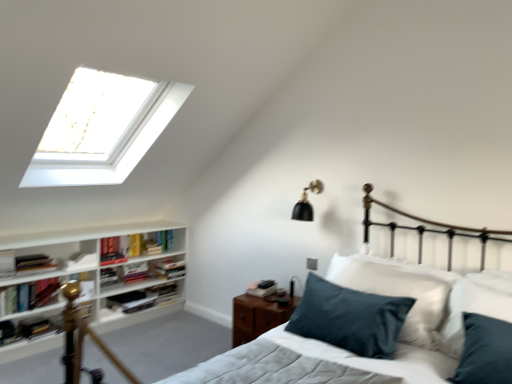
The width and height of the screenshot is (512, 384). Find the location of `hardcover book at center, placed as the 3th book when sorted from bottom to top`. hardcover book at center, placed as the 3th book when sorted from bottom to top is located at coordinates click(163, 291).

Describe the element at coordinates (163, 291) in the screenshot. I see `hardcover book at center, the 7th book viewed from the top` at that location.

The height and width of the screenshot is (384, 512). In order to click on white wooden bookshelf at left in this screenshot , I will do tap(96, 272).

Describe the element at coordinates (143, 298) in the screenshot. This screenshot has width=512, height=384. I see `hardcover book at center, which appears as the second book when ordered from the bottom` at that location.

What is the approximate width of black matte wall sconce at upper right?

24.34 centimeters.

The width and height of the screenshot is (512, 384). What do you see at coordinates (169, 268) in the screenshot? I see `hardcover book at center-left, the fourth book when ordered from top to bottom` at bounding box center [169, 268].

This screenshot has width=512, height=384. I want to click on white paper at left, which is the seventh book in bottom-to-top order, so click(x=81, y=262).

From the image's perspective, which is above, teal satin pillow at center or hardcover book at center, placed as the 3th book when sorted from bottom to top?

From the image's view, teal satin pillow at center is above.

Consider the image. How far apart are teal satin pillow at center and hardcover book at center, the 7th book viewed from the top?

2.85 meters.

In the scene shown: Is teal satin pillow at center positioned in front of hardcover book at center, placed as the 3th book when sorted from bottom to top?

Yes, it is in front of hardcover book at center, placed as the 3th book when sorted from bottom to top.

Does teal satin pillow at center have a greater width compared to hardcover book at center, placed as the 3th book when sorted from bottom to top?

Correct, the width of teal satin pillow at center exceeds that of hardcover book at center, placed as the 3th book when sorted from bottom to top.

Is hardcover book at left, which appears as the sixth book when viewed from the top, oriented towards hardcover book at center-left, which is counted as the sixth book, starting from the bottom?

No, hardcover book at left, which appears as the sixth book when viewed from the top, is not oriented towards hardcover book at center-left, which is counted as the sixth book, starting from the bottom.

Does hardcover book at left, which appears as the sixth book when viewed from the top, contain hardcover book at center-left, which is counted as the sixth book, starting from the bottom?

No, hardcover book at center-left, which is counted as the sixth book, starting from the bottom, is not a part of hardcover book at left, which appears as the sixth book when viewed from the top.

Which is behind, point (50, 295) or point (157, 263)?

The point (157, 263) is more distant.

Considering the positions of objects hardcover book at left, which appears as the sixth book when viewed from the top, and hardcover book at center-left, which is counted as the sixth book, starting from the bottom, in the image provided, who is in front, hardcover book at left, which appears as the sixth book when viewed from the top, or hardcover book at center-left, which is counted as the sixth book, starting from the bottom,?

Positioned in front is hardcover book at left, which appears as the sixth book when viewed from the top.

Is hardcover book at left, placed as the ninth book when sorted from bottom to top, surrounding white wooden bookshelf at left?

→ That's incorrect, white wooden bookshelf at left is not inside hardcover book at left, placed as the ninth book when sorted from bottom to top.

Is hardcover book at left, placed as the 1th book when sorted from top to bottom, touching white wooden bookshelf at left?

There is a gap between hardcover book at left, placed as the 1th book when sorted from top to bottom, and white wooden bookshelf at left.

Does teal satin pillow at center have a larger size compared to hardcover book at left, placed as the ninth book when sorted from bottom to top?

Yes, teal satin pillow at center is bigger than hardcover book at left, placed as the ninth book when sorted from bottom to top.

Which object is positioned more to the right, teal satin pillow at center or hardcover book at left, placed as the 1th book when sorted from top to bottom?

teal satin pillow at center.

Which point is more distant from viewer, (460, 348) or (9, 271)?

The point (9, 271) is farther from the camera.

Can you confirm if teal satin pillow at center is shorter than hardcover book at left, placed as the ninth book when sorted from bottom to top?

No, teal satin pillow at center is not shorter than hardcover book at left, placed as the ninth book when sorted from bottom to top.

Looking at this image, which of these two, hardcover book at center, which is the 8th book in top-to-bottom order, or white paper at left, marked as the 3th book in a top-to-bottom arrangement, is thinner?

With smaller width is white paper at left, marked as the 3th book in a top-to-bottom arrangement.

Considering the relative positions of hardcover book at center, which is the 8th book in top-to-bottom order, and white paper at left, which is the seventh book in bottom-to-top order, in the image provided, is hardcover book at center, which is the 8th book in top-to-bottom order, behind white paper at left, which is the seventh book in bottom-to-top order,?

Yes, it is behind white paper at left, which is the seventh book in bottom-to-top order.

Considering the sizes of objects hardcover book at center, which is the 8th book in top-to-bottom order, and white paper at left, which is the seventh book in bottom-to-top order, in the image provided, who is smaller, hardcover book at center, which is the 8th book in top-to-bottom order, or white paper at left, which is the seventh book in bottom-to-top order,?

white paper at left, which is the seventh book in bottom-to-top order.

Does point (233, 315) appear closer or farther from the camera than point (114, 296)?

Clearly, point (233, 315) is closer to the camera than point (114, 296).

Are wooden nightstand at lower right and hardcover book at center, which is the 8th book in top-to-bottom order, located far from each other?

wooden nightstand at lower right is far away from hardcover book at center, which is the 8th book in top-to-bottom order.

Considering the sizes of objects wooden nightstand at lower right and hardcover book at center, which is the 8th book in top-to-bottom order, in the image provided, who is smaller, wooden nightstand at lower right or hardcover book at center, which is the 8th book in top-to-bottom order,?

Smaller between the two is hardcover book at center, which is the 8th book in top-to-bottom order.

Is wooden nightstand at lower right in front of or behind hardcover book at center, which appears as the second book when ordered from the bottom, in the image?

In the image, wooden nightstand at lower right appears in front of hardcover book at center, which appears as the second book when ordered from the bottom.

Is hardcover book at left, arranged as the 8th book when ordered from the bottom, inside the boundaries of white paper at left, which is the seventh book in bottom-to-top order, or outside?

The correct answer is: outside.

Considering the relative positions of hardcover book at left, arranged as the 8th book when ordered from the bottom, and white paper at left, marked as the 3th book in a top-to-bottom arrangement, in the image provided, is hardcover book at left, arranged as the 8th book when ordered from the bottom, to the right of white paper at left, marked as the 3th book in a top-to-bottom arrangement, from the viewer's perspective?

Incorrect, hardcover book at left, arranged as the 8th book when ordered from the bottom, is not on the right side of white paper at left, marked as the 3th book in a top-to-bottom arrangement.

Does hardcover book at left, marked as the 2th book in a top-to-bottom arrangement, have a larger size compared to white paper at left, which is the seventh book in bottom-to-top order?

Indeed, hardcover book at left, marked as the 2th book in a top-to-bottom arrangement, has a larger size compared to white paper at left, which is the seventh book in bottom-to-top order.

Considering the relative sizes of hardcover book at left, arranged as the 8th book when ordered from the bottom, and white paper at left, marked as the 3th book in a top-to-bottom arrangement, in the image provided, is hardcover book at left, arranged as the 8th book when ordered from the bottom, thinner than white paper at left, marked as the 3th book in a top-to-bottom arrangement,?

Incorrect, the width of hardcover book at left, arranged as the 8th book when ordered from the bottom, is not less than that of white paper at left, marked as the 3th book in a top-to-bottom arrangement.

Locate an element on the screen. Image resolution: width=512 pixels, height=384 pixels. the 9th book behind the teal satin pillow at center is located at coordinates (163, 291).

The image size is (512, 384). Find the location of `the 5th book to the right of the hardcover book at left, which appears as the sixth book when viewed from the top, counting from the anchor's position`. the 5th book to the right of the hardcover book at left, which appears as the sixth book when viewed from the top, counting from the anchor's position is located at coordinates 169,268.

Based on their spatial positions, is hardcover book at center, placed as the 3th book when sorted from bottom to top, or wooden nightstand at lower right further from hardcover book at left, which is counted as the first book, starting from the bottom?

Among the two, wooden nightstand at lower right is located further to hardcover book at left, which is counted as the first book, starting from the bottom.

Looking at the image, which one is located closer to teal satin pillow at center, hardcover book at center, the 7th book viewed from the top, or hardcover book at center, which appears as the second book when ordered from the bottom?

hardcover book at center, which appears as the second book when ordered from the bottom, is closer to teal satin pillow at center.

When comparing their distances from hardcover book at left, placed as the ninth book when sorted from bottom to top, does wooden nightstand at lower right or hardcover book at upper left, which is the 5th book from top to bottom, seem closer?

hardcover book at upper left, which is the 5th book from top to bottom, is positioned closer to the anchor hardcover book at left, placed as the ninth book when sorted from bottom to top.

Based on their spatial positions, is hardcover book at left, which is counted as the first book, starting from the bottom, or wooden nightstand at lower right further from white paper at left, which is the seventh book in bottom-to-top order?

wooden nightstand at lower right lies further to white paper at left, which is the seventh book in bottom-to-top order, than the other object.

Which object lies further to the anchor point white wooden bookshelf at left, hardcover book at center-left, the fourth book when ordered from top to bottom, or teal satin pillow at center?

teal satin pillow at center is positioned further to the anchor white wooden bookshelf at left.

When comparing their distances from white paper at left, marked as the 3th book in a top-to-bottom arrangement, does hardcover book at left, which appears as the sixth book when viewed from the top, or hardcover book at center, which appears as the second book when ordered from the bottom, seem closer?

Among the two, hardcover book at left, which appears as the sixth book when viewed from the top, is located nearer to white paper at left, marked as the 3th book in a top-to-bottom arrangement.

Based on their spatial positions, is hardcover book at center, the 7th book viewed from the top, or black matte wall sconce at upper right closer to hardcover book at left, placed as the 1th book when sorted from top to bottom?

hardcover book at center, the 7th book viewed from the top, is positioned closer to the anchor hardcover book at left, placed as the 1th book when sorted from top to bottom.

Estimate the real-world distances between objects in this image. Which object is further from white paper at left, marked as the 3th book in a top-to-bottom arrangement, hardcover book at center-left, which is counted as the sixth book, starting from the bottom, or wooden nightstand at lower right?

wooden nightstand at lower right is further to white paper at left, marked as the 3th book in a top-to-bottom arrangement.

Locate an element on the screen. The image size is (512, 384). nightstand situated between hardcover book at left, placed as the ninth book when sorted from bottom to top, and black matte wall sconce at upper right from left to right is located at coordinates (258, 316).

Locate an element on the screen. nightstand between hardcover book at upper left, which is the 5th book from top to bottom, and black matte wall sconce at upper right is located at coordinates (258, 316).

What are the coordinates of `shelf between hardcover book at left, placed as the ninth book when sorted from bottom to top, and hardcover book at left, which is counted as the first book, starting from the bottom, in the vertical direction` in the screenshot? It's located at (96, 272).

Find the location of a particular element. This screenshot has width=512, height=384. light fixture between hardcover book at left, marked as the 2th book in a top-to-bottom arrangement, and teal satin pillow at center is located at coordinates (306, 202).